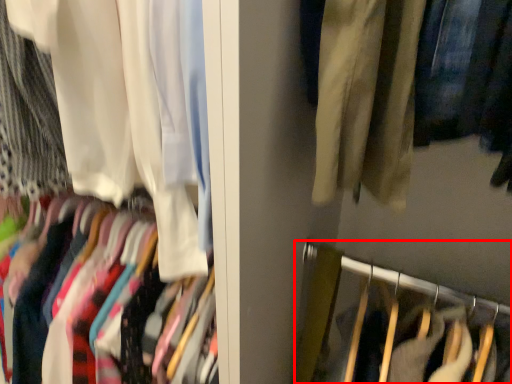
Question: Observing the image, what is the correct spatial positioning of closet (annotated by the red box) in reference to curtain?

Choices:
 (A) right
 (B) left

Answer: (A)